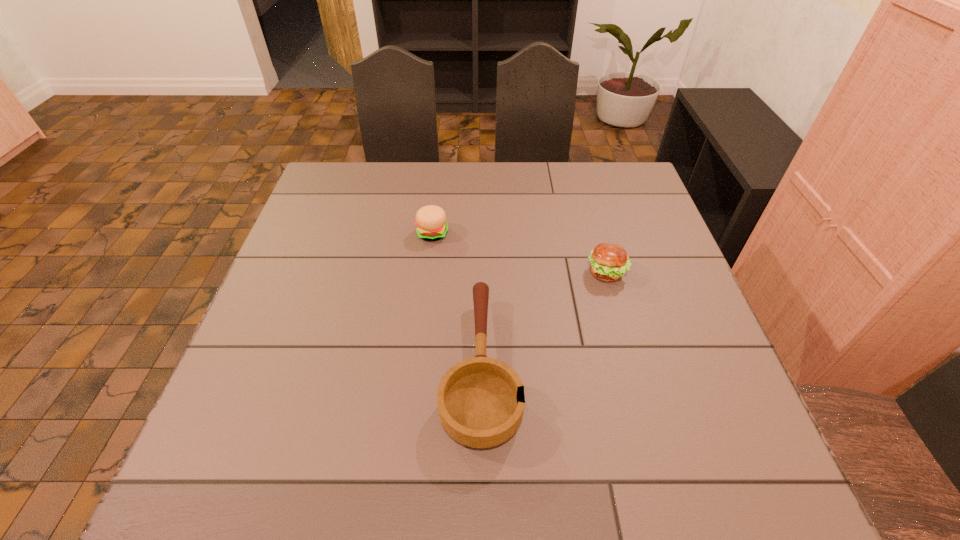
The image size is (960, 540). What are the coordinates of `the nearer hamburger` in the screenshot? It's located at (609, 262).

The height and width of the screenshot is (540, 960). I want to click on the rightmost object, so click(609, 262).

Where is `the farthest object`? Image resolution: width=960 pixels, height=540 pixels. the farthest object is located at coordinates (431, 223).

The height and width of the screenshot is (540, 960). Find the location of `the leftmost object`. the leftmost object is located at coordinates (431, 223).

Locate an element on the screen. The image size is (960, 540). saucepan is located at coordinates (481, 401).

The width and height of the screenshot is (960, 540). In order to click on the second object from left to right in this screenshot , I will do `click(481, 401)`.

This screenshot has width=960, height=540. I want to click on blank space located on the right of the second farthest object, so click(675, 273).

Find the location of a particular element. vacant space situated on the right of the farther hamburger is located at coordinates tap(489, 233).

Find the location of a particular element. Image resolution: width=960 pixels, height=540 pixels. free space located with the handle on the side of the nearest object is located at coordinates (481, 222).

At what (x,y) coordinates should I click in order to perform the action: click on vacant space positioned with the handle on the side of the nearest object. Please return your answer as a coordinate pair (x, y). Looking at the image, I should click on (481, 251).